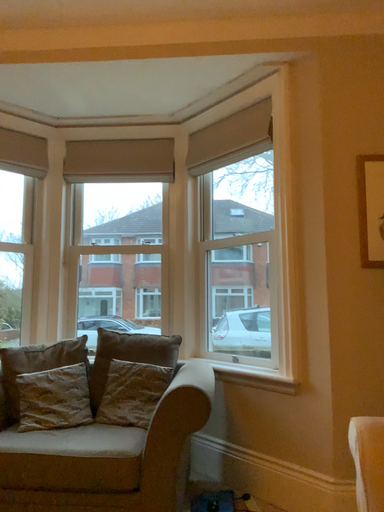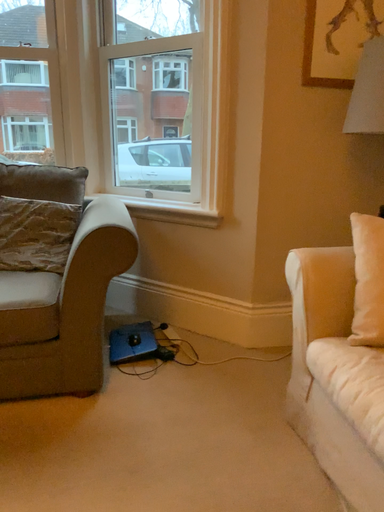
Question: Which way did the camera rotate in the video?

Choices:
 (A) rotated upward
 (B) rotated downward

Answer: (B)